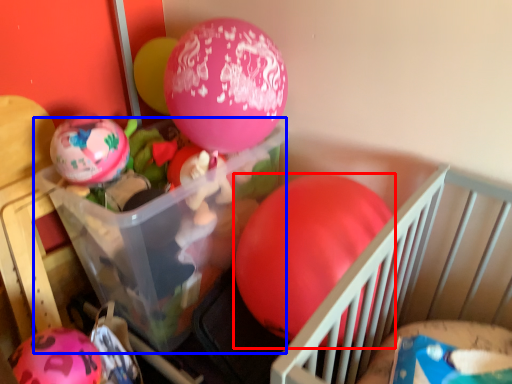
Question: Which of the following is the farthest to the observer, balloon (highlighted by a red box) or storage box (highlighted by a blue box)?

Choices:
 (A) balloon
 (B) storage box

Answer: (B)